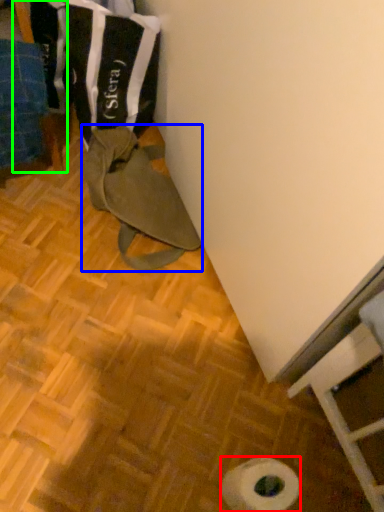
Question: Based on their relative distances, which object is farther from toilet paper (highlighted by a red box)? Choose from wide (highlighted by a blue box) and wood (highlighted by a green box).

Choices:
 (A) wide
 (B) wood

Answer: (B)